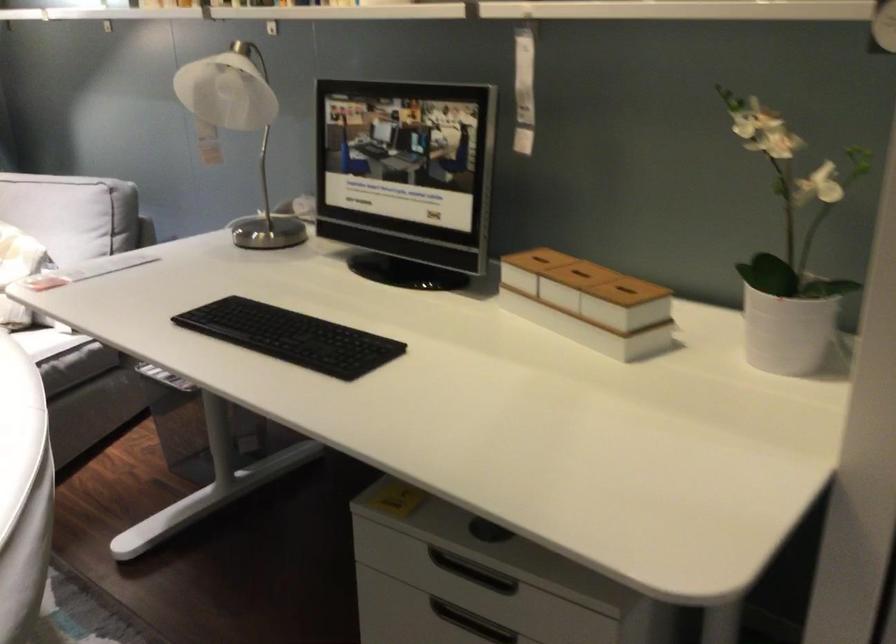
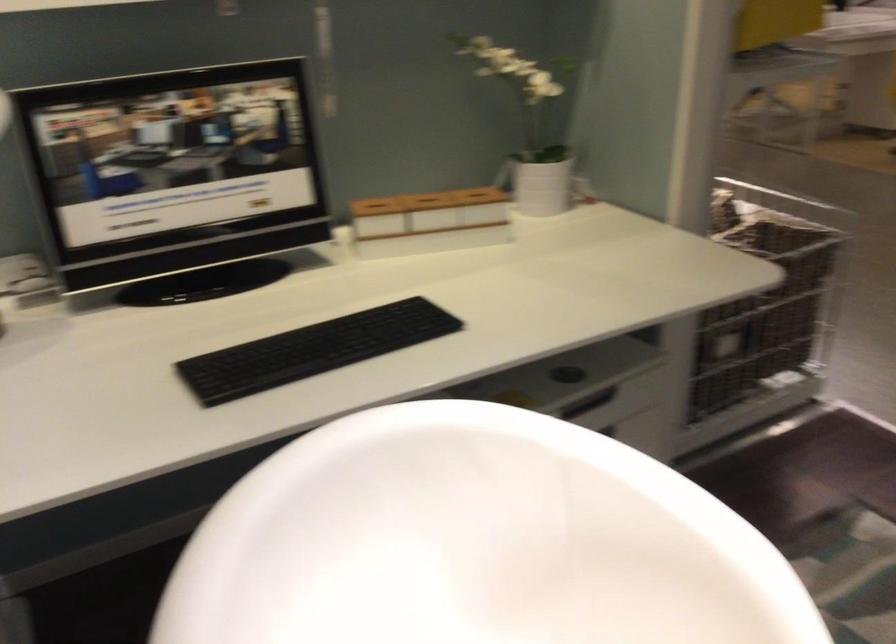
In the second image, find the point that corresponds to the point at 543,256 in the first image.

(375, 204)